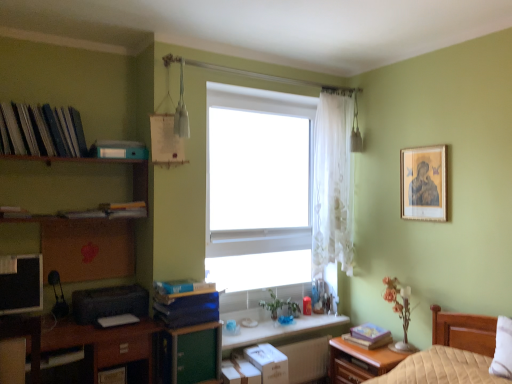
Question: Does brown wooden desk at lower left appear on the right side of white matte window at center?

Choices:
 (A) no
 (B) yes

Answer: (A)

Question: From a real-world perspective, is brown wooden desk at lower left under white matte window at center?

Choices:
 (A) yes
 (B) no

Answer: (A)

Question: Is brown wooden desk at lower left facing towards white matte window at center?

Choices:
 (A) no
 (B) yes

Answer: (A)

Question: Can you confirm if brown wooden desk at lower left is positioned to the left of white matte window at center?

Choices:
 (A) no
 (B) yes

Answer: (B)

Question: Can you confirm if brown wooden desk at lower left is taller than white matte window at center?

Choices:
 (A) no
 (B) yes

Answer: (A)

Question: From the image's perspective, would you say brown wooden desk at lower left is positioned over white matte window at center?

Choices:
 (A) no
 (B) yes

Answer: (A)

Question: Is black plastic printer at lower left directly adjacent to white sheer curtain at center?

Choices:
 (A) yes
 (B) no

Answer: (B)

Question: From a real-world perspective, is black plastic printer at lower left physically below white sheer curtain at center?

Choices:
 (A) no
 (B) yes

Answer: (B)

Question: Is black plastic printer at lower left at the right side of white sheer curtain at center?

Choices:
 (A) no
 (B) yes

Answer: (A)

Question: Is white sheer curtain at center completely or partially inside black plastic printer at lower left?

Choices:
 (A) yes
 (B) no

Answer: (B)

Question: From the image's perspective, is black plastic printer at lower left beneath white sheer curtain at center?

Choices:
 (A) yes
 (B) no

Answer: (A)

Question: From a real-world perspective, is black plastic printer at lower left positioned over white sheer curtain at center based on gravity?

Choices:
 (A) yes
 (B) no

Answer: (B)

Question: Is the position of wooden nightstand at lower right less distant than that of black plastic printer at lower left?

Choices:
 (A) yes
 (B) no

Answer: (B)